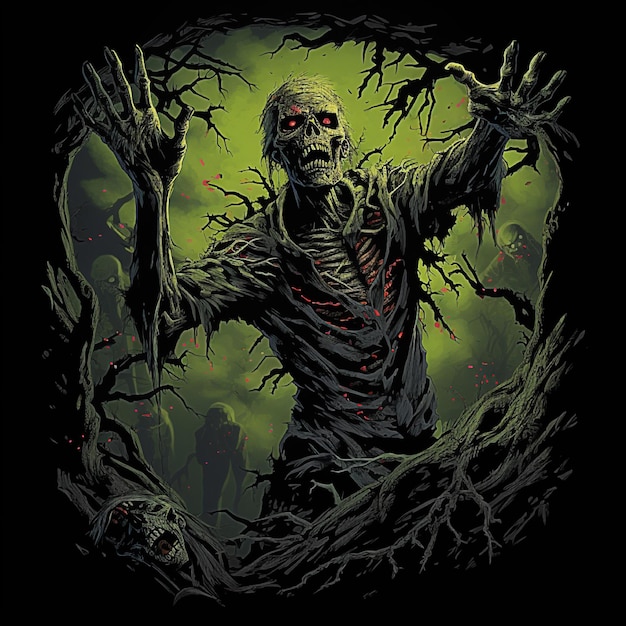
This screenshot has height=626, width=626. I want to click on rags, so click(341, 351).